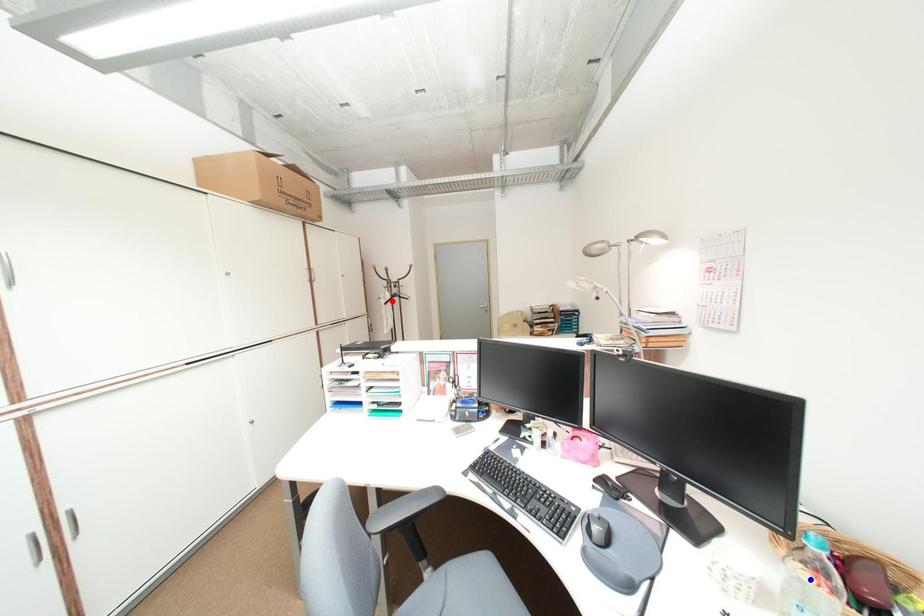
Question: Which of the two points in the image is closer to the camera?

Choices:
 (A) Blue point is closer.
 (B) Red point is closer.

Answer: (A)